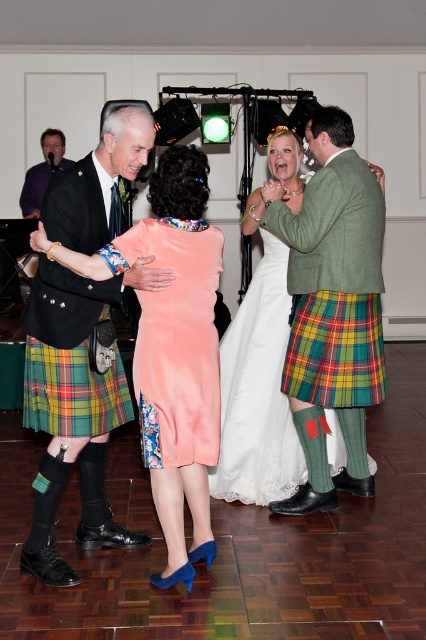
Question: Is silky coral dress at center wider than purple satin shirt at upper left?

Choices:
 (A) no
 (B) yes

Answer: (B)

Question: Is silky coral dress at center below purple satin shirt at upper left?

Choices:
 (A) yes
 (B) no

Answer: (A)

Question: Which object appears closest to the camera in this image?

Choices:
 (A) tartan plaid kilt at left
 (B) matte green kilt at center

Answer: (B)

Question: Does white satin dress at center lie behind purple satin shirt at upper left?

Choices:
 (A) yes
 (B) no

Answer: (B)

Question: Which point is farther from the camera taking this photo?

Choices:
 (A) (114, 269)
 (B) (141, 349)
 (C) (374, 348)
 (D) (40, 400)

Answer: (C)

Question: Which point is farther to the camera?

Choices:
 (A) plaid fabric kilt at center
 (B) matte green kilt at center
 (C) peach velvet dress at center
 (D) purple satin shirt at upper left

Answer: (D)